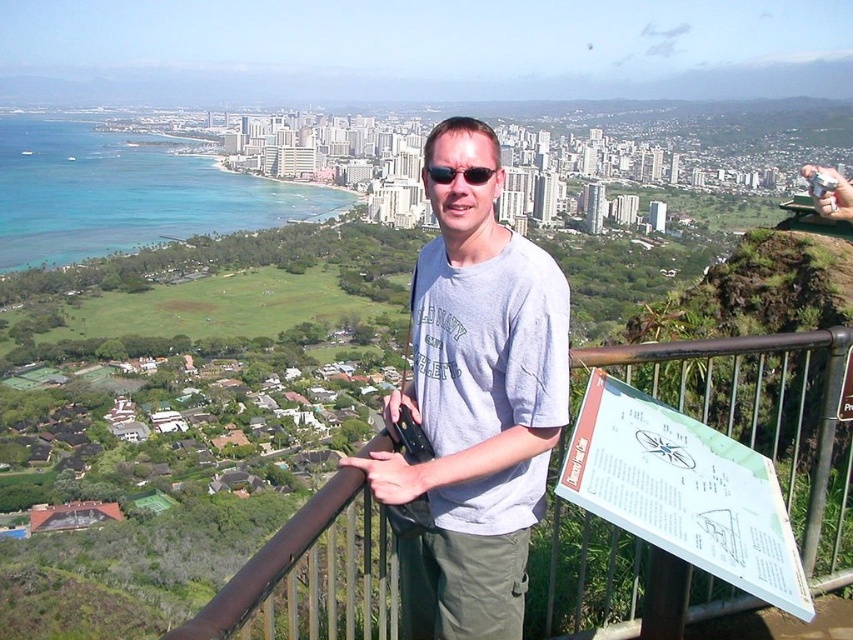
Can you confirm if brown metal/rail at center is shorter than black plastic sunglasses at center?

In fact, brown metal/rail at center may be taller than black plastic sunglasses at center.

Which is in front, point (724, 358) or point (445, 173)?

Positioned in front is point (724, 358).

Is point (838, 339) positioned before point (474, 180)?

Yes, point (838, 339) is in front of point (474, 180).

Identify the location of brown metal/rail at center. This screenshot has height=640, width=853. (764, 419).

The height and width of the screenshot is (640, 853). What do you see at coordinates (474, 403) in the screenshot? I see `gray cotton t-shirt at center` at bounding box center [474, 403].

Can you confirm if gray cotton t-shirt at center is positioned above black plastic sunglasses at center?

No.

Does point (439, 333) lie in front of point (469, 172)?

Yes, it is.

Identify the location of gray cotton t-shirt at center. (474, 403).

Does brown metal/rail at center appear over gray cotton t-shirt at center?

Incorrect, brown metal/rail at center is not positioned above gray cotton t-shirt at center.

Looking at this image, which is more to the left, brown metal/rail at center or gray cotton t-shirt at center?

From the viewer's perspective, gray cotton t-shirt at center appears more on the left side.

At what (x,y) coordinates should I click in order to perform the action: click on brown metal/rail at center. Please return your answer as a coordinate pair (x, y). The width and height of the screenshot is (853, 640). Looking at the image, I should click on (764, 419).